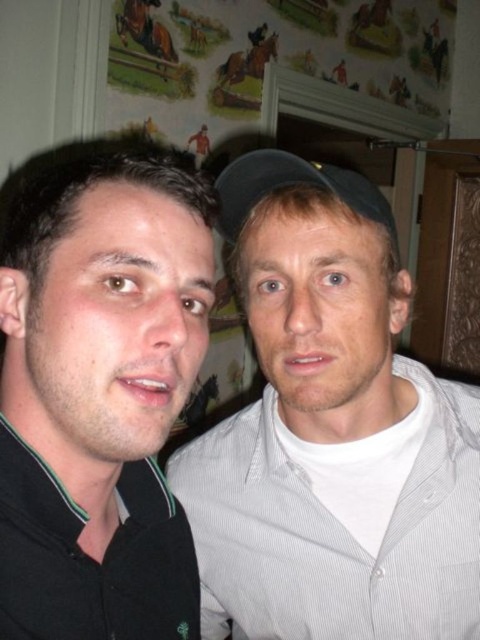
The image size is (480, 640). I want to click on gray striped shirt at center, so click(x=328, y=429).

Does gray striped shirt at center appear over black fabric baseball cap at center?

Incorrect, gray striped shirt at center is not positioned above black fabric baseball cap at center.

You are a GUI agent. You are given a task and a screenshot of the screen. Output one action in this format:
    pyautogui.click(x=<x>, y=<y>)
    Task: Click on the gray striped shirt at center
    
    Given the screenshot: What is the action you would take?
    pyautogui.click(x=328, y=429)

Based on the photo, does gray striped shirt at center have a lesser width compared to black matte shirt at left?

Incorrect, gray striped shirt at center's width is not less than black matte shirt at left's.

Who is more distant from viewer, (422,484) or (66,241)?

Point (422,484)

Image resolution: width=480 pixels, height=640 pixels. What are the coordinates of `gray striped shirt at center` in the screenshot? It's located at (328, 429).

Can you confirm if black matte shirt at left is positioned to the right of black fabric baseball cap at center?

In fact, black matte shirt at left is to the left of black fabric baseball cap at center.

Between point (112, 432) and point (259, 156), which one is positioned behind?

Positioned behind is point (259, 156).

Where is `black matte shirt at left`? black matte shirt at left is located at coordinates [99, 397].